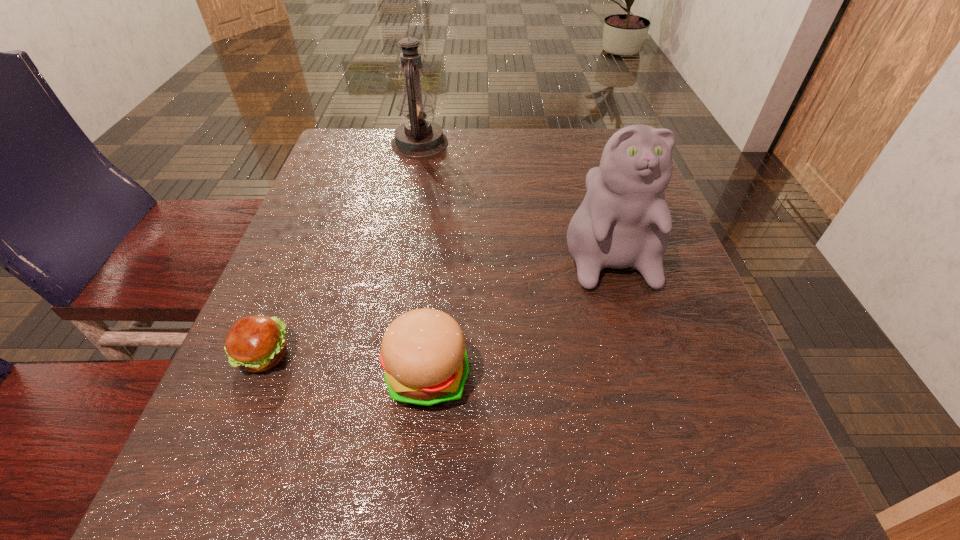
The height and width of the screenshot is (540, 960). Find the location of `vacant area at the far left corner of the desktop`. vacant area at the far left corner of the desktop is located at coordinates (377, 135).

Image resolution: width=960 pixels, height=540 pixels. In order to click on free region at the near left corner in this screenshot , I will do `click(308, 462)`.

Locate an element on the screen. This screenshot has height=540, width=960. vacant area at the far right corner of the desktop is located at coordinates (595, 145).

This screenshot has width=960, height=540. I want to click on free point between the taller hamburger and the oil lamp, so click(x=423, y=260).

The width and height of the screenshot is (960, 540). In order to click on vacant space that is in between the leftmost object and the third nearest object in this screenshot , I will do `click(434, 294)`.

This screenshot has height=540, width=960. I want to click on free spot between the rightmost object and the right hamburger, so click(x=516, y=305).

At what (x,y) coordinates should I click in order to perform the action: click on vacant space that is in between the shorter hamburger and the right hamburger. Please return your answer as a coordinate pair (x, y). The width and height of the screenshot is (960, 540). Looking at the image, I should click on (346, 366).

I want to click on empty location between the right hamburger and the shortest object, so [x=346, y=366].

This screenshot has width=960, height=540. Find the location of `vacant area that lies between the farthest object and the leftmost object`. vacant area that lies between the farthest object and the leftmost object is located at coordinates (342, 249).

Image resolution: width=960 pixels, height=540 pixels. I want to click on vacant area between the shortest object and the rightmost object, so click(x=434, y=294).